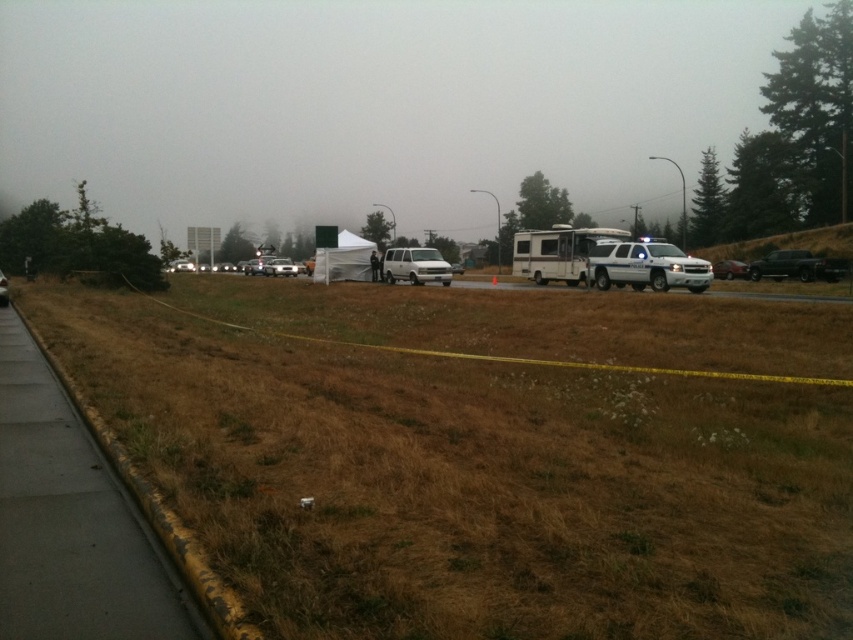
Is white glossy suv at right shorter than metallic silver sedan at right?

No, white glossy suv at right is not shorter than metallic silver sedan at right.

Does point (670, 284) come farther from viewer compared to point (733, 262)?

No, (670, 284) is in front of (733, 262).

Who is more forward, (636, 276) or (730, 269)?

Point (636, 276) is more forward.

The width and height of the screenshot is (853, 640). I want to click on white glossy suv at right, so click(x=646, y=266).

Does white matte van at center come in front of metallic silver sedan at right?

That is True.

Measure the distance between point (428, 256) and camera.

Point (428, 256) and camera are 35.05 meters apart.

Identify the location of white matte van at center. (x=415, y=266).

Between brown dry grass at lower left and metallic silver sedan at right, which one has less height?

With less height is brown dry grass at lower left.

Does point (548, 593) come farther from viewer compared to point (723, 268)?

No, it is not.

Locate an element on the screen. The image size is (853, 640). brown dry grass at lower left is located at coordinates (486, 456).